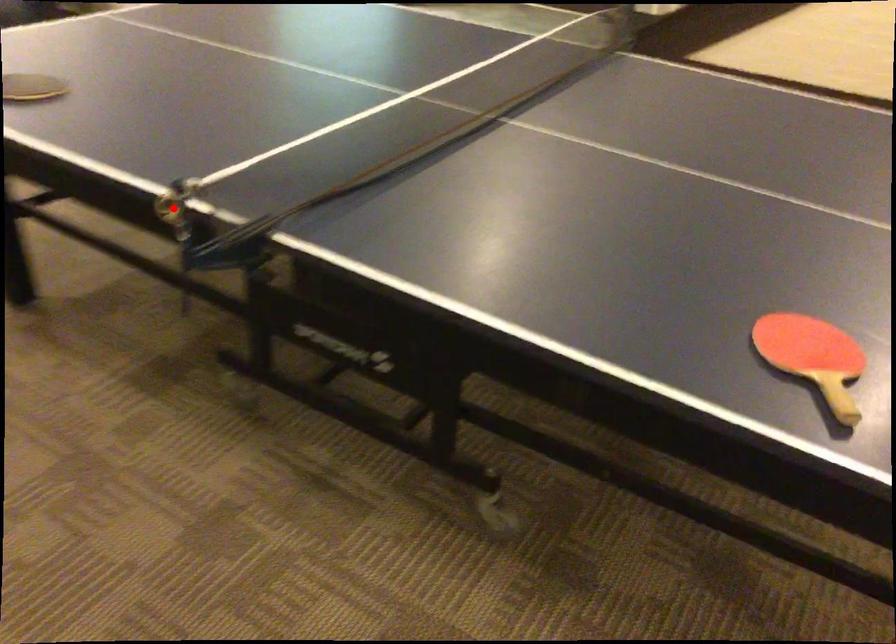
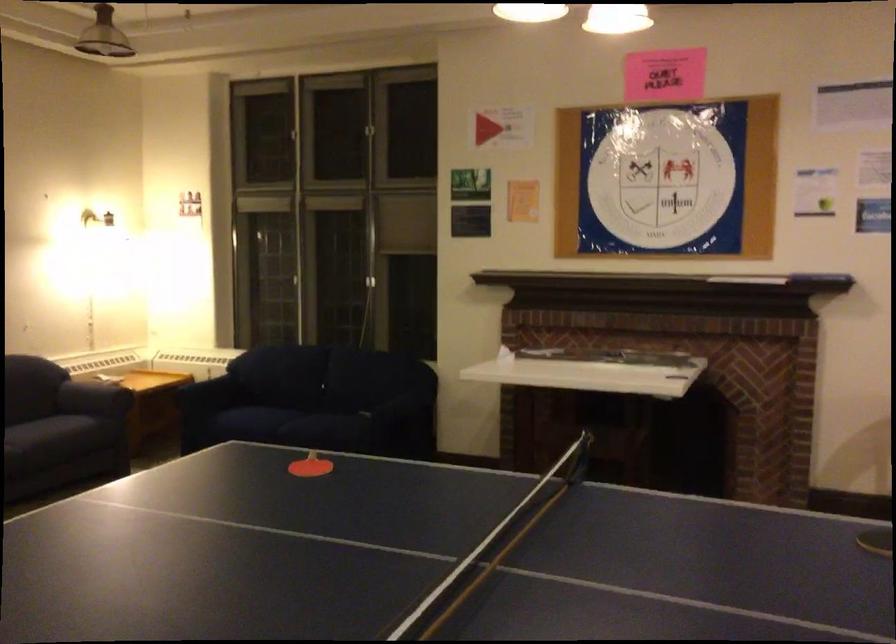
Question: I am providing you with two images of the same scene from different viewpoints. A red point is marked on the first image. At the location where the point appears in image 1, is it still visible in image 2?

Choices:
 (A) Yes
 (B) No

Answer: (B)